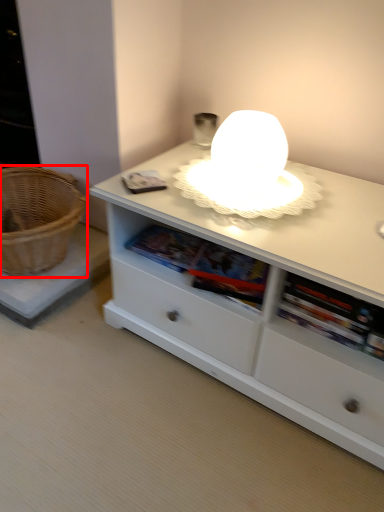
Question: In this image, where is basket (annotated by the red box) located relative to table?

Choices:
 (A) right
 (B) left

Answer: (B)